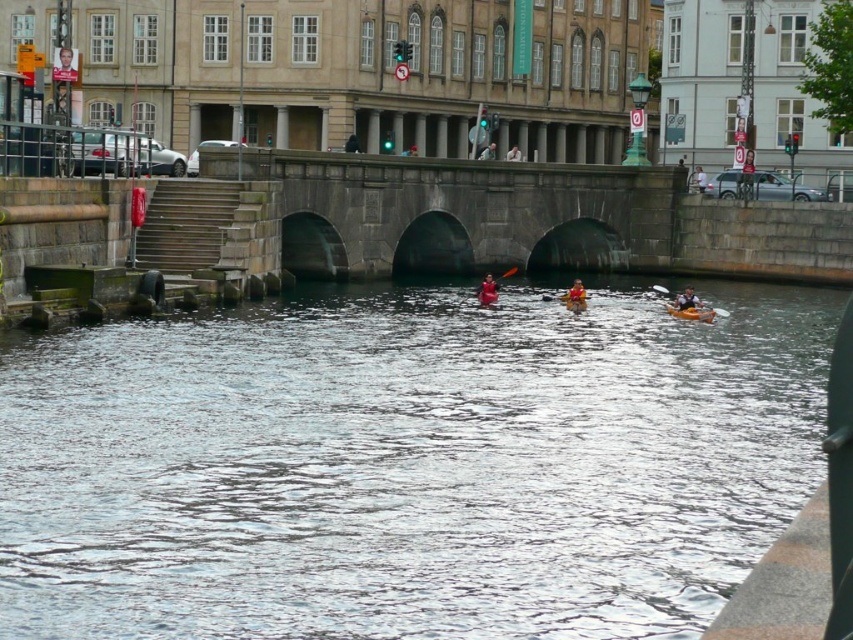
Question: Which point is closer to the camera?

Choices:
 (A) dark gray stone bridge at center
 (B) yellow plastic canoe at center

Answer: (A)

Question: Which of the following is the closest to the observer?

Choices:
 (A) orange kayak at center
 (B) dark gray stone bridge at center
 (C) yellow fabric kayak at center

Answer: (B)

Question: Is smooth skin face at center to the right of yellow fabric kayak at center from the viewer's perspective?

Choices:
 (A) yes
 (B) no

Answer: (B)

Question: Where is orange kayak at center located in relation to yellow plastic canoe at center in the image?

Choices:
 (A) below
 (B) above

Answer: (B)

Question: Which point is farther from the camera taking this photo?

Choices:
 (A) (711, 320)
 (B) (492, 298)
 (C) (56, 68)

Answer: (B)

Question: Is dark gray stone bridge at center further to camera compared to red fabric kayak at center?

Choices:
 (A) no
 (B) yes

Answer: (A)